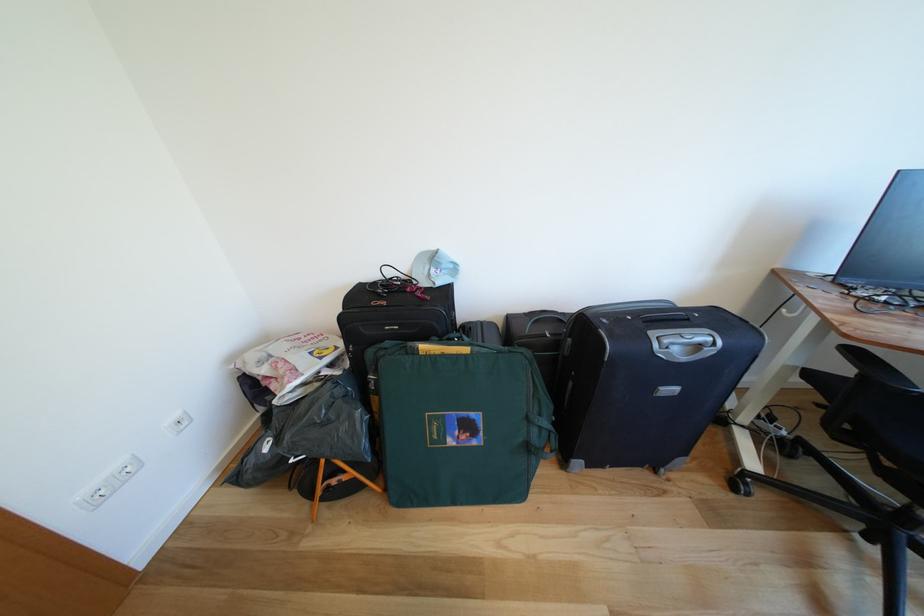
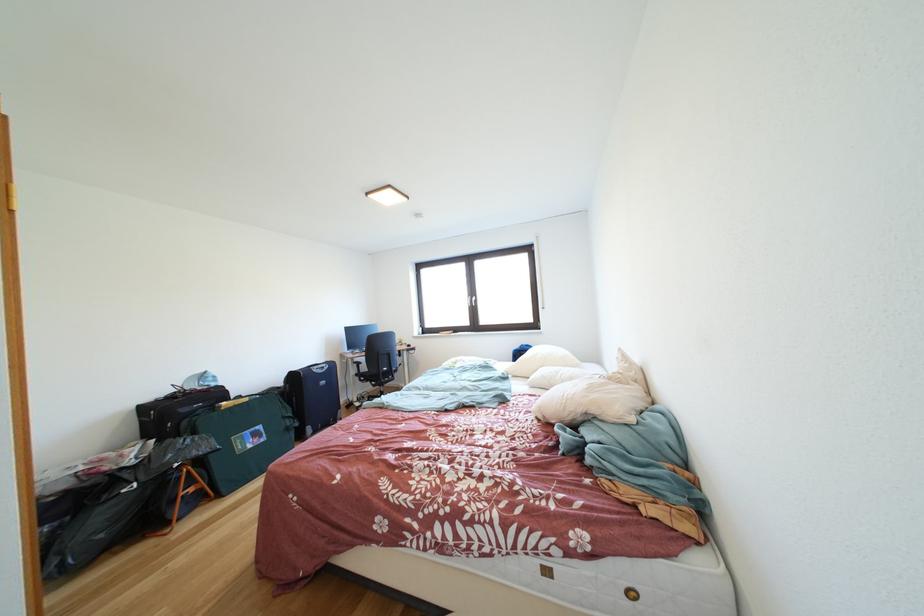
In the second image, find the point that corresponds to [893,477] in the first image.

(383, 391)